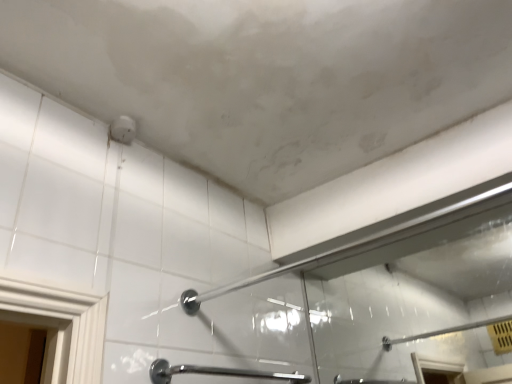
Question: Is polished chrome grab bar at lower center wider than white glossy shower at center?

Choices:
 (A) yes
 (B) no

Answer: (A)

Question: Does polished chrome grab bar at lower center have a lesser width compared to white glossy shower at center?

Choices:
 (A) no
 (B) yes

Answer: (A)

Question: From the image's perspective, is polished chrome grab bar at lower center beneath white glossy shower at center?

Choices:
 (A) yes
 (B) no

Answer: (A)

Question: Does polished chrome grab bar at lower center turn towards white glossy shower at center?

Choices:
 (A) no
 (B) yes

Answer: (A)

Question: Does polished chrome grab bar at lower center have a lesser height compared to white glossy shower at center?

Choices:
 (A) yes
 (B) no

Answer: (B)

Question: From a real-world perspective, is polished chrome grab bar at lower center located beneath white glossy shower at center?

Choices:
 (A) yes
 (B) no

Answer: (A)

Question: From a real-world perspective, is white glossy shower at center positioned under polished chrome grab bar at lower center based on gravity?

Choices:
 (A) no
 (B) yes

Answer: (A)

Question: Would you say white glossy shower at center contains polished chrome grab bar at lower center?

Choices:
 (A) no
 (B) yes

Answer: (A)

Question: Is white glossy shower at center not close to polished chrome grab bar at lower center?

Choices:
 (A) no
 (B) yes

Answer: (A)

Question: Can you confirm if white glossy shower at center is taller than polished chrome grab bar at lower center?

Choices:
 (A) no
 (B) yes

Answer: (A)

Question: Can you confirm if white glossy shower at center is positioned to the left of polished chrome grab bar at lower center?

Choices:
 (A) yes
 (B) no

Answer: (B)

Question: Considering the relative sizes of white glossy shower at center and polished chrome grab bar at lower center in the image provided, is white glossy shower at center bigger than polished chrome grab bar at lower center?

Choices:
 (A) no
 (B) yes

Answer: (B)

Question: In the image, is polished chrome grab bar at lower center positioned in front of or behind white glossy shower at center?

Choices:
 (A) behind
 (B) front

Answer: (A)